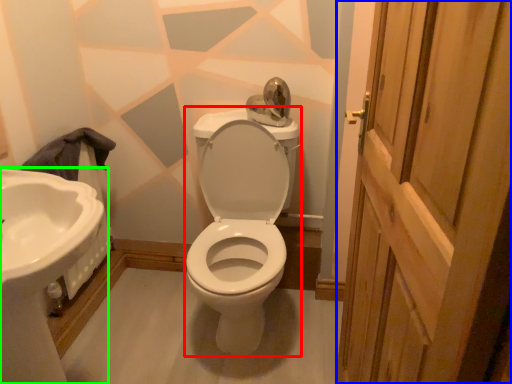
Question: Which is nearer to the porcelain (highlighted by a red box)? screen door (highlighted by a blue box) or sink (highlighted by a green box).

Choices:
 (A) screen door
 (B) sink

Answer: (B)